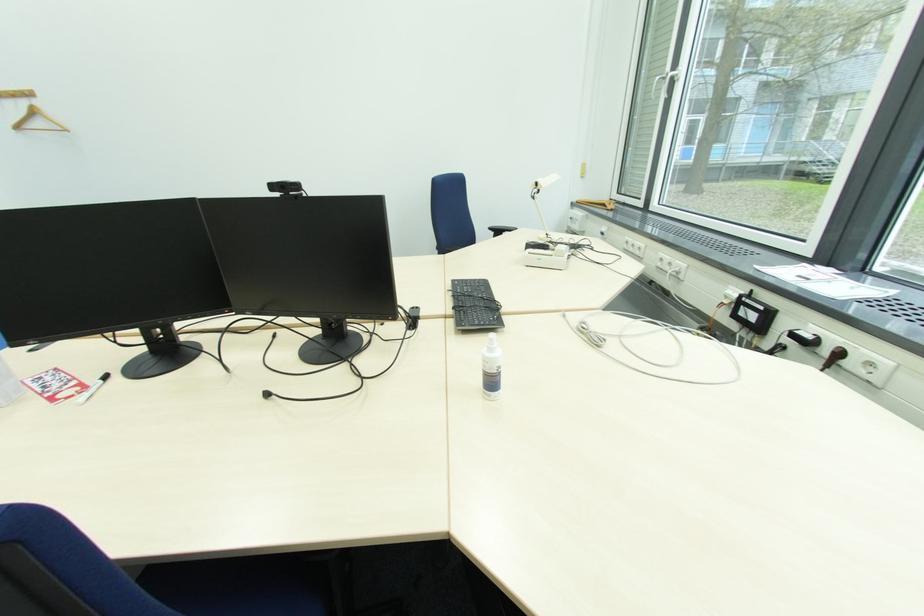
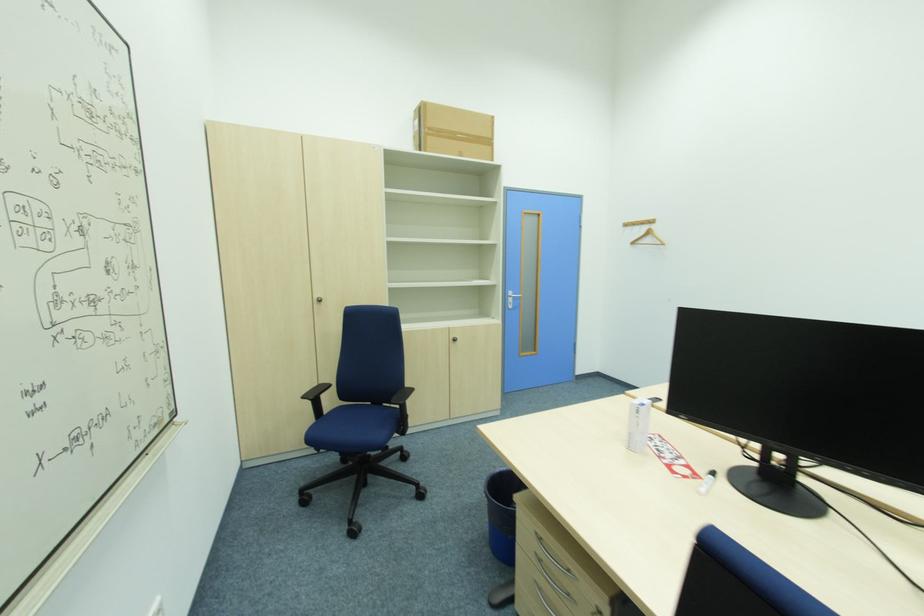
Question: The first image is from the beginning of the video and the second image is from the end. How did the camera likely rotate when shooting the video?

Choices:
 (A) Left
 (B) Right
 (C) Up
 (D) Down

Answer: (A)